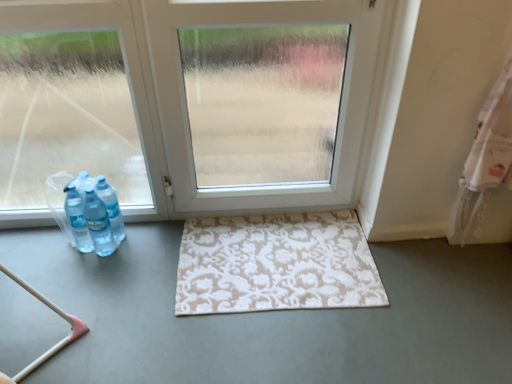
Question: Is white matte rug at center inside white matte door at center?

Choices:
 (A) yes
 (B) no

Answer: (B)

Question: Is white matte door at center bigger than white matte rug at center?

Choices:
 (A) no
 (B) yes

Answer: (A)

Question: Does white matte door at center lie in front of white matte rug at center?

Choices:
 (A) no
 (B) yes

Answer: (A)

Question: Is there a large distance between white matte door at center and white matte rug at center?

Choices:
 (A) yes
 (B) no

Answer: (B)

Question: From a real-world perspective, is white matte door at center on white matte rug at center?

Choices:
 (A) yes
 (B) no

Answer: (A)

Question: Considering the relative sizes of white matte door at center and white matte rug at center in the image provided, is white matte door at center taller than white matte rug at center?

Choices:
 (A) no
 (B) yes

Answer: (B)

Question: Considering the relative sizes of white matte rug at center and beige patterned rug at center in the image provided, is white matte rug at center thinner than beige patterned rug at center?

Choices:
 (A) no
 (B) yes

Answer: (A)

Question: From a real-world perspective, is white matte rug at center physically below beige patterned rug at center?

Choices:
 (A) no
 (B) yes

Answer: (B)

Question: Is white matte rug at center further to camera compared to beige patterned rug at center?

Choices:
 (A) no
 (B) yes

Answer: (A)

Question: From the image's perspective, is white matte rug at center on top of beige patterned rug at center?

Choices:
 (A) no
 (B) yes

Answer: (A)

Question: Is white matte rug at center positioned with its back to beige patterned rug at center?

Choices:
 (A) no
 (B) yes

Answer: (B)

Question: Is white matte rug at center wider than beige patterned rug at center?

Choices:
 (A) no
 (B) yes

Answer: (B)

Question: From a real-world perspective, is translucent plastic bottles at left over beige patterned rug at center?

Choices:
 (A) no
 (B) yes

Answer: (B)